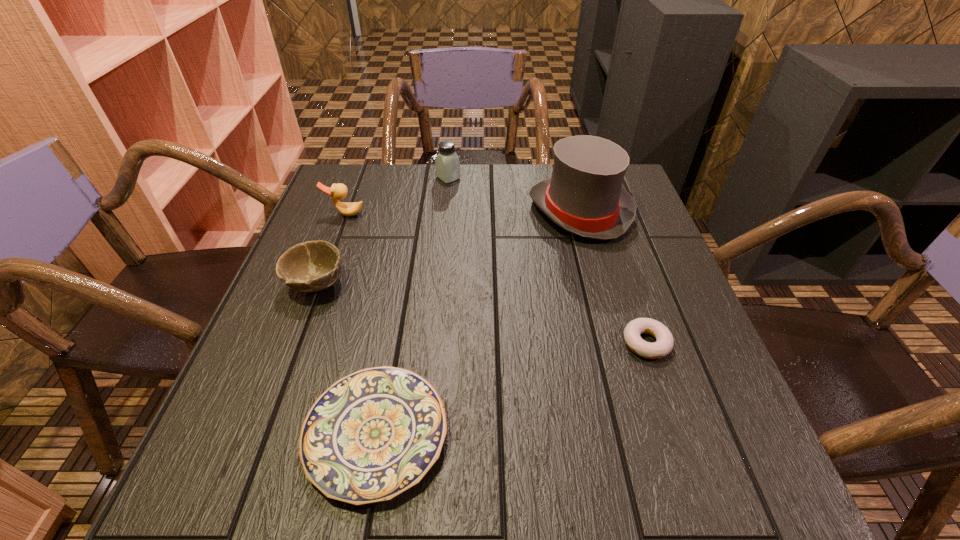
You are a GUI agent. You are given a task and a screenshot of the screen. Output one action in this format:
    pyautogui.click(x=<x>, y=<y>)
    Task: Click on the free space between the saltshaker and the second nearest object
    The image size is (960, 540).
    Given the screenshot: What is the action you would take?
    pyautogui.click(x=547, y=260)

The height and width of the screenshot is (540, 960). I want to click on blank region between the duck and the second shortest object, so (495, 279).

Locate an element on the screen. The width and height of the screenshot is (960, 540). vacant area that lies between the duck and the shortest object is located at coordinates (361, 324).

The image size is (960, 540). I want to click on object that is the closest to the doughnut, so click(585, 196).

Choose which object is the fourth nearest neighbor to the doughnut. Please provide its 2D coordinates. Your answer should be formatted as a tuple, i.e. [(x, y)], where the tuple contains the x and y coordinates of a point satisfying the conditions above.

[(447, 163)]

At what (x,y) coordinates should I click in order to perform the action: click on vacant space that satisfies the following two spatial constraints: 1. on the beak of the second shortest object; 2. on the right side of the duck. Please return your answer as a coordinate pair (x, y). The image size is (960, 540). Looking at the image, I should click on (298, 343).